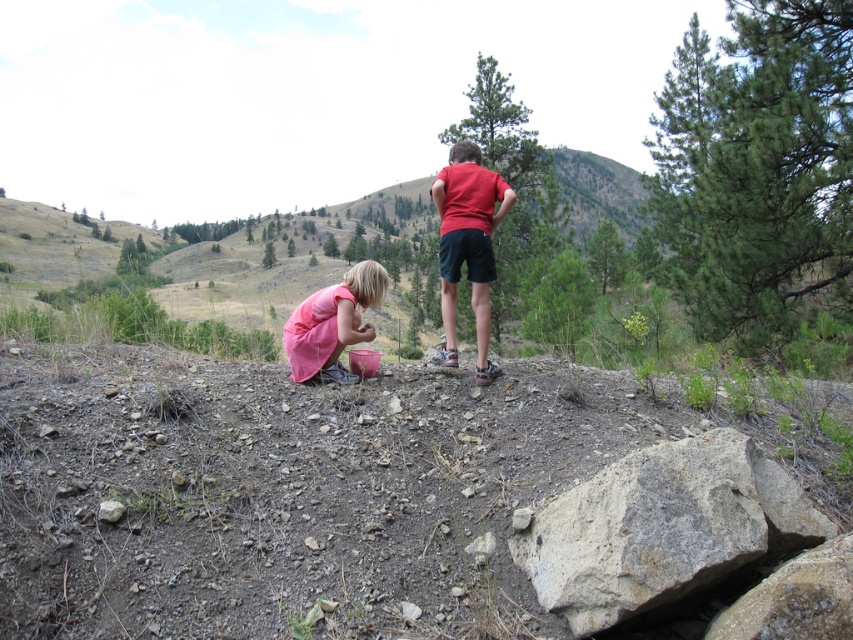
Question: Is gray rough rock at lower right further to the viewer compared to pink matte dress at lower center?

Choices:
 (A) no
 (B) yes

Answer: (A)

Question: Is gray rough rock at lower right above pink matte dress at lower center?

Choices:
 (A) no
 (B) yes

Answer: (A)

Question: Which object appears closest to the camera in this image?

Choices:
 (A) gray rough rock at lower right
 (B) red matte shirt at center
 (C) pink matte dress at lower center

Answer: (A)

Question: Among these objects, which one is nearest to the camera?

Choices:
 (A) gray rough rock at lower right
 (B) red matte shirt at center
 (C) pink matte dress at lower center

Answer: (A)

Question: Can you confirm if gray rough rock at lower right is smaller than pink matte dress at lower center?

Choices:
 (A) yes
 (B) no

Answer: (B)

Question: Which object appears farthest from the camera in this image?

Choices:
 (A) pink matte dress at lower center
 (B) red matte shirt at center

Answer: (A)